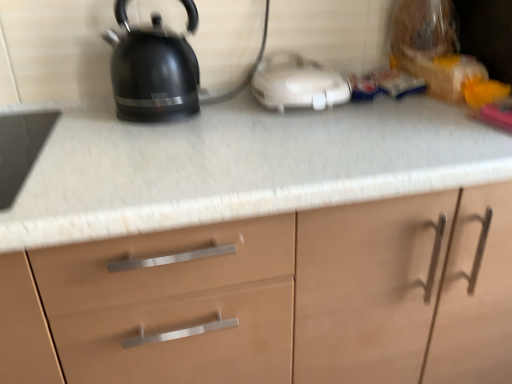
Identify the location of matte wood cabinet at center. This screenshot has width=512, height=384. (274, 299).

Describe the element at coordinates (298, 83) in the screenshot. I see `white plastic toaster at center` at that location.

This screenshot has width=512, height=384. I want to click on black glossy kettle at upper left, so click(x=152, y=71).

Image resolution: width=512 pixels, height=384 pixels. What do you see at coordinates (152, 71) in the screenshot? I see `black glossy kettle at upper left` at bounding box center [152, 71].

This screenshot has width=512, height=384. Find the location of `matte wood cabinet at center`. matte wood cabinet at center is located at coordinates coord(274,299).

In terms of size, does white plastic toaster at center appear bigger or smaller than black glossy kettle at upper left?

In the image, white plastic toaster at center appears to be smaller than black glossy kettle at upper left.

In the scene shown: Which object is wider, white plastic toaster at center or black glossy kettle at upper left?

With larger width is white plastic toaster at center.

From the image's perspective, which is above, white plastic toaster at center or black glossy kettle at upper left?

black glossy kettle at upper left appears higher in the image.

Which is more to the left, white plastic toaster at center or black glossy kettle at upper left?

Positioned to the left is black glossy kettle at upper left.

Is point (136, 78) closer or farther from the camera than point (506, 246)?

Point (136, 78) is positioned farther from the camera compared to point (506, 246).

Can you tell me how much black glossy kettle at upper left and matte wood cabinet at center differ in facing direction?

The angular difference between black glossy kettle at upper left and matte wood cabinet at center is 1.35 degrees.

In the scene shown: Is black glossy kettle at upper left facing towards matte wood cabinet at center?

No, black glossy kettle at upper left does not turn towards matte wood cabinet at center.

Can you confirm if black glossy kettle at upper left is taller than matte wood cabinet at center?

Incorrect, the height of black glossy kettle at upper left is not larger of that of matte wood cabinet at center.

Is matte wood cabinet at center in front of or behind white plastic toaster at center in the image?

matte wood cabinet at center is in front of white plastic toaster at center.

Can you see matte wood cabinet at center touching white plastic toaster at center?

No, matte wood cabinet at center is not next to white plastic toaster at center.

The image size is (512, 384). I want to click on cabinetry located on the left of white plastic toaster at center, so click(x=274, y=299).

From a real-world perspective, which object stands above the other?

black glossy kettle at upper left is physically above.

Which of these two, black glossy kettle at upper left or white plastic toaster at center, stands shorter?

With less height is white plastic toaster at center.

Does black glossy kettle at upper left have a smaller size compared to white plastic toaster at center?

No, black glossy kettle at upper left is not smaller than white plastic toaster at center.

From a real-world perspective, is white plastic toaster at center physically located above or below matte wood cabinet at center?

In terms of real-world spatial position, white plastic toaster at center is above matte wood cabinet at center.

From the image's perspective, would you say white plastic toaster at center is positioned over matte wood cabinet at center?

Yes, from the image's perspective, white plastic toaster at center is over matte wood cabinet at center.

Would you say white plastic toaster at center is inside or outside matte wood cabinet at center?

white plastic toaster at center is located beyond the bounds of matte wood cabinet at center.

Who is bigger, white plastic toaster at center or matte wood cabinet at center?

With larger size is matte wood cabinet at center.

Considering the sizes of objects matte wood cabinet at center and black glossy kettle at upper left in the image provided, who is taller, matte wood cabinet at center or black glossy kettle at upper left?

Standing taller between the two is matte wood cabinet at center.

In order to click on kettle that is above the matte wood cabinet at center (from a real-world perspective) in this screenshot , I will do `click(152, 71)`.

In terms of width, does matte wood cabinet at center look wider or thinner when compared to black glossy kettle at upper left?

Considering their sizes, matte wood cabinet at center looks broader than black glossy kettle at upper left.

You are a GUI agent. You are given a task and a screenshot of the screen. Output one action in this format:
    pyautogui.click(x=<x>, y=<y>)
    Task: Click on the appliance on the right of black glossy kettle at upper left
    The width and height of the screenshot is (512, 384).
    Given the screenshot: What is the action you would take?
    pyautogui.click(x=298, y=83)

This screenshot has width=512, height=384. What are the coordinates of `cabinetry lying below the black glossy kettle at upper left (from the image's perspective)` in the screenshot? It's located at (274, 299).

Based on their spatial positions, is matte wood cabinet at center or black glossy kettle at upper left further from white plastic toaster at center?

The object further to white plastic toaster at center is matte wood cabinet at center.

From the image, which object appears to be farther from white plastic toaster at center, black glossy kettle at upper left or matte wood cabinet at center?

Among the two, matte wood cabinet at center is located further to white plastic toaster at center.

From the picture: Which object lies nearer to the anchor point black glossy kettle at upper left, white plastic toaster at center or matte wood cabinet at center?

Among the two, white plastic toaster at center is located nearer to black glossy kettle at upper left.

Based on their spatial positions, is black glossy kettle at upper left or white plastic toaster at center closer to matte wood cabinet at center?

white plastic toaster at center is closer to matte wood cabinet at center.

Considering their positions, is white plastic toaster at center positioned closer to matte wood cabinet at center than black glossy kettle at upper left?

white plastic toaster at center lies closer to matte wood cabinet at center than the other object.

From the image, which object appears to be farther from black glossy kettle at upper left, matte wood cabinet at center or white plastic toaster at center?

matte wood cabinet at center lies further to black glossy kettle at upper left than the other object.

You are a GUI agent. You are given a task and a screenshot of the screen. Output one action in this format:
    pyautogui.click(x=<x>, y=<y>)
    Task: Click on the appliance that lies between black glossy kettle at upper left and matte wood cabinet at center from top to bottom
    This screenshot has height=384, width=512.
    Given the screenshot: What is the action you would take?
    pyautogui.click(x=298, y=83)